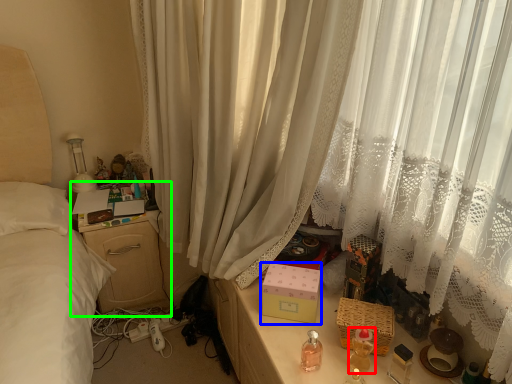
Question: Based on their relative distances, which object is nearer to baby bottle (highlighted by a red box)? Choose from box (highlighted by a blue box) and nightstand (highlighted by a green box).

Choices:
 (A) box
 (B) nightstand

Answer: (A)